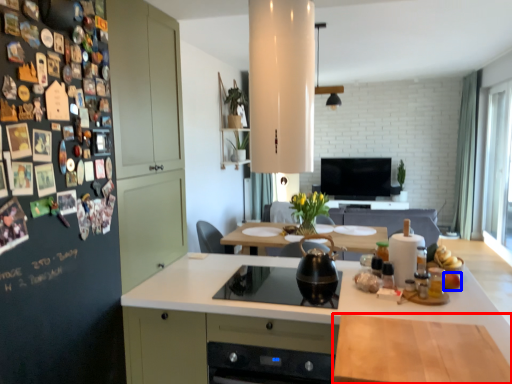
Question: Which object is further to the camera taking this photo, countertop (highlighted by a red box) or food (highlighted by a blue box)?

Choices:
 (A) countertop
 (B) food

Answer: (B)